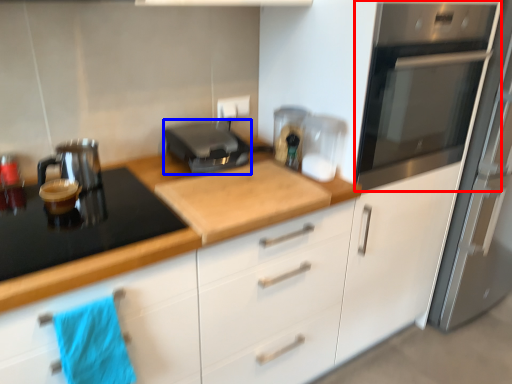
Question: Which object appears farthest to the camera in this image, home appliance (highlighted by a red box) or kitchen appliance (highlighted by a blue box)?

Choices:
 (A) home appliance
 (B) kitchen appliance

Answer: (B)